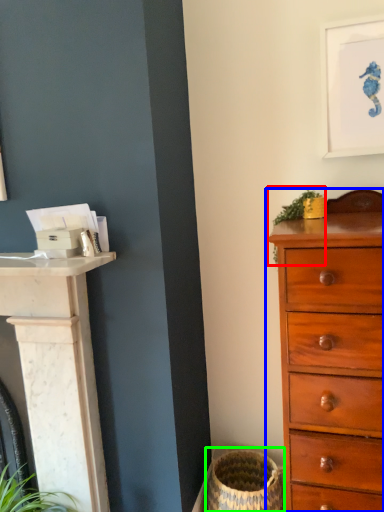
Question: Which object is the farthest from plant (highlighted by a red box)? Choose among these: chest of drawers (highlighted by a blue box) or basket container (highlighted by a green box).

Choices:
 (A) chest of drawers
 (B) basket container

Answer: (B)